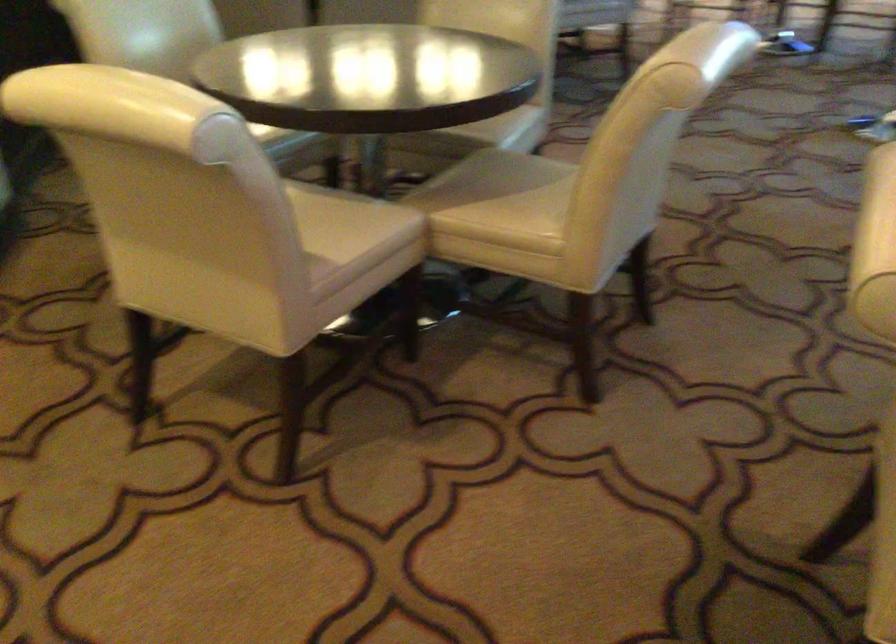
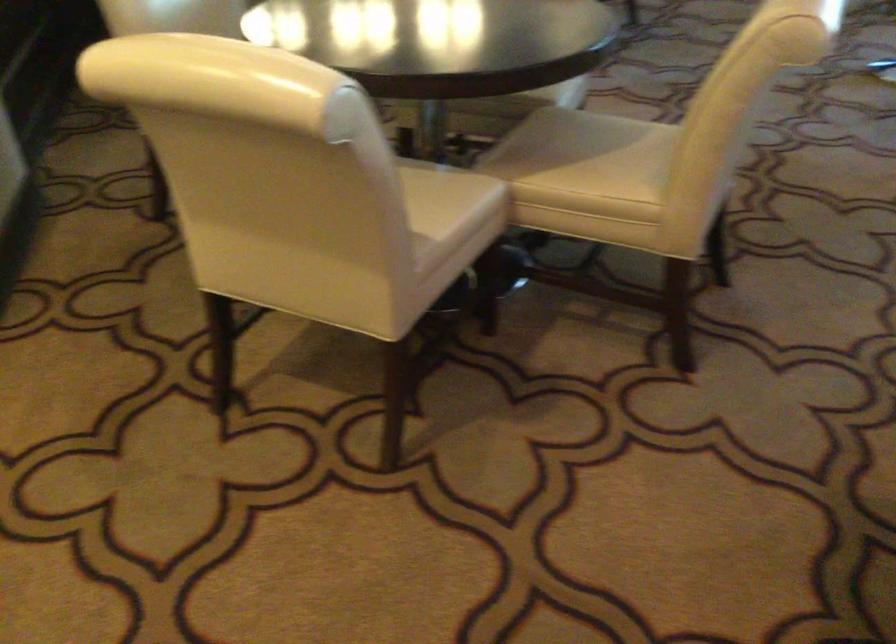
Where in the second image is the point corresponding to [357,200] from the first image?

(437, 167)